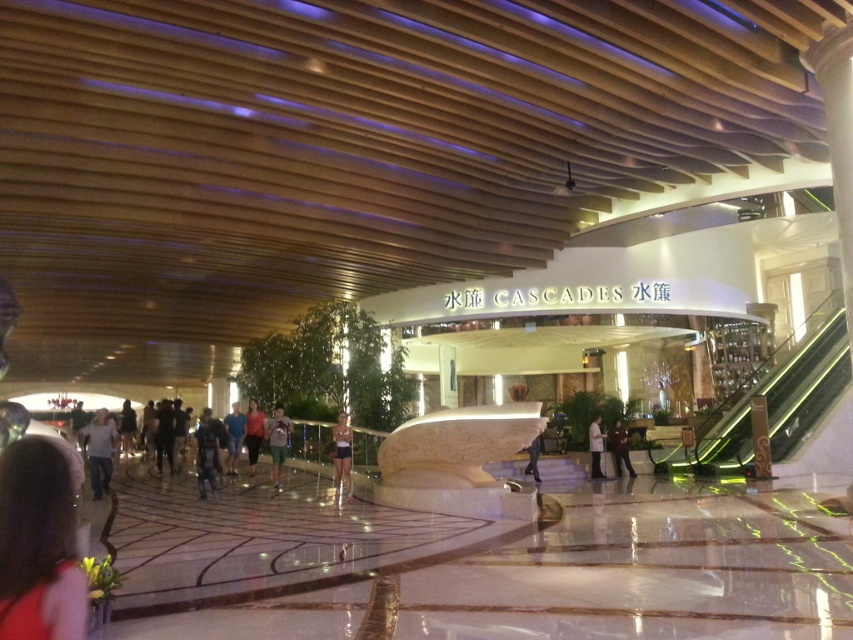
Based on the photo, can you confirm if light gray fabric shirt at lower left is wider than light blue jeans at center?

Yes, light gray fabric shirt at lower left is wider than light blue jeans at center.

Does light gray fabric shirt at lower left appear on the right side of light blue jeans at center?

In fact, light gray fabric shirt at lower left is to the left of light blue jeans at center.

Does point (102, 490) come in front of point (235, 436)?

Yes, point (102, 490) is closer to viewer.

Where is `light gray fabric shirt at lower left`? Image resolution: width=853 pixels, height=640 pixels. light gray fabric shirt at lower left is located at coordinates (99, 451).

Does red fabric dress at lower left appear over green fabric shorts at center?

Yes, red fabric dress at lower left is above green fabric shorts at center.

Does red fabric dress at lower left have a lesser width compared to green fabric shorts at center?

Yes, red fabric dress at lower left is thinner than green fabric shorts at center.

At what (x,y) coordinates should I click in order to perform the action: click on red fabric dress at lower left. Please return your answer as a coordinate pair (x, y). Looking at the image, I should click on (38, 545).

At what (x,y) coordinates should I click in order to perform the action: click on red fabric dress at lower left. Please return your answer as a coordinate pair (x, y). This screenshot has width=853, height=640. Looking at the image, I should click on (38, 545).

Between light blue jeans at center and dark blue jeans at center, which one is positioned higher?

light blue jeans at center

Who is positioned more to the left, light blue jeans at center or dark blue jeans at center?

From the viewer's perspective, light blue jeans at center appears more on the left side.

What do you see at coordinates (234, 436) in the screenshot?
I see `light blue jeans at center` at bounding box center [234, 436].

Where is `light blue jeans at center`? light blue jeans at center is located at coordinates (234, 436).